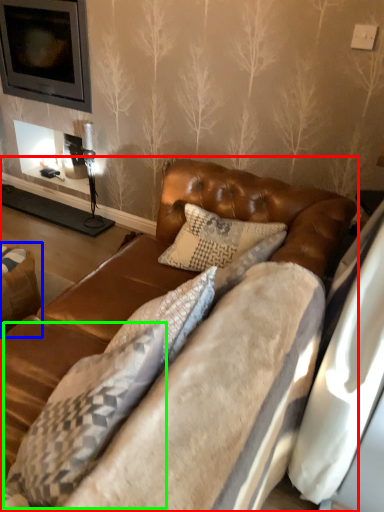
Question: Which object is positioned farthest from studio couch (highlighted by a red box)? Select from swivel chair (highlighted by a blue box) and pillow (highlighted by a green box).

Choices:
 (A) swivel chair
 (B) pillow

Answer: (A)